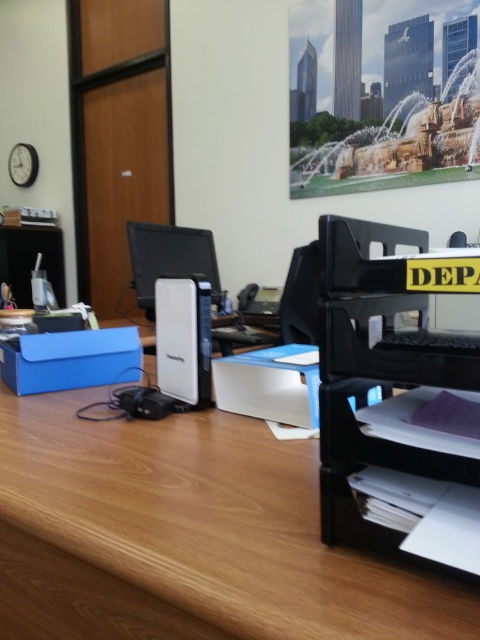
Is wooden at center wider than white plastic desktop computer at center?

Yes.

Consider the image. Does wooden at center have a larger size compared to white plastic desktop computer at center?

Indeed, wooden at center has a larger size compared to white plastic desktop computer at center.

Which is in front, point (95, 570) or point (154, 237)?

Point (95, 570)

Locate an element on the screen. The width and height of the screenshot is (480, 640). wooden at center is located at coordinates (188, 536).

Does blue matte box at left have a greater width compared to white matte box at center?

Indeed, blue matte box at left has a greater width compared to white matte box at center.

Is blue matte box at left to the left of white matte box at center from the viewer's perspective?

Yes, blue matte box at left is to the left of white matte box at center.

Which is behind, point (135, 337) or point (307, 381)?

The point (135, 337) is behind.

Locate an element on the screen. blue matte box at left is located at coordinates (70, 358).

Can you confirm if blue matte box at left is smaller than white plastic desktop computer at center?

Indeed, blue matte box at left has a smaller size compared to white plastic desktop computer at center.

Which of these two, blue matte box at left or white plastic desktop computer at center, stands shorter?

blue matte box at left

What do you see at coordinates (70, 358) in the screenshot? I see `blue matte box at left` at bounding box center [70, 358].

Image resolution: width=480 pixels, height=640 pixels. Find the location of `blue matte box at left`. blue matte box at left is located at coordinates (70, 358).